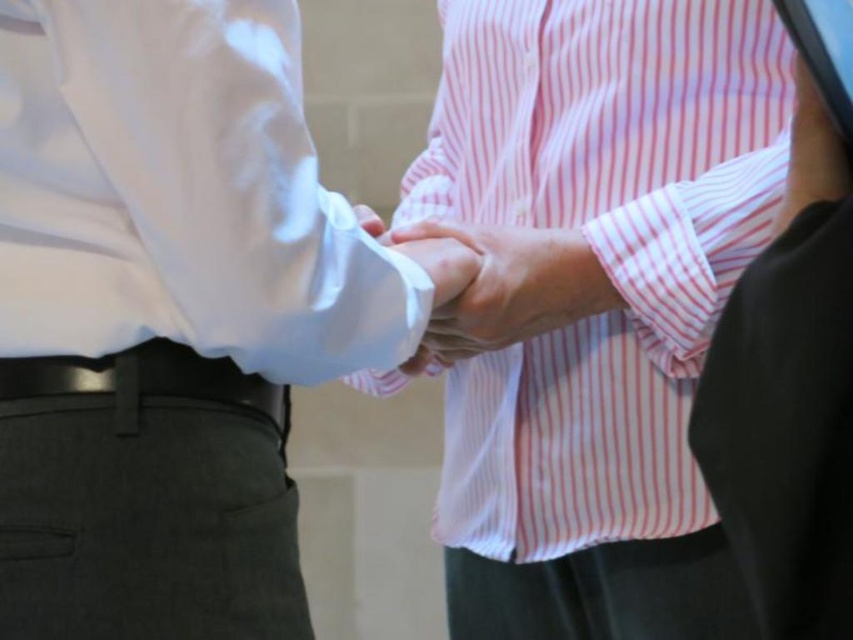
Question: Among these objects, which one is nearest to the camera?

Choices:
 (A) white smooth shirt at center
 (B) pink striped shirt at center

Answer: (A)

Question: Which point is farther from the camera taking this photo?

Choices:
 (A) (227, 403)
 (B) (582, 285)
 (C) (131, 51)
 (D) (544, 371)

Answer: (D)

Question: Is white smooth shirt at center thinner than black leather belt at lower left?

Choices:
 (A) yes
 (B) no

Answer: (B)

Question: Is pink striped shirt at center bigger than black leather belt at lower left?

Choices:
 (A) no
 (B) yes

Answer: (B)

Question: Can you confirm if pink striped shirt at center is thinner than black leather belt at lower left?

Choices:
 (A) yes
 (B) no

Answer: (B)

Question: Among these objects, which one is nearest to the camera?

Choices:
 (A) pink striped shirt at center
 (B) white smooth shirt at center
 (C) black leather belt at lower left

Answer: (B)